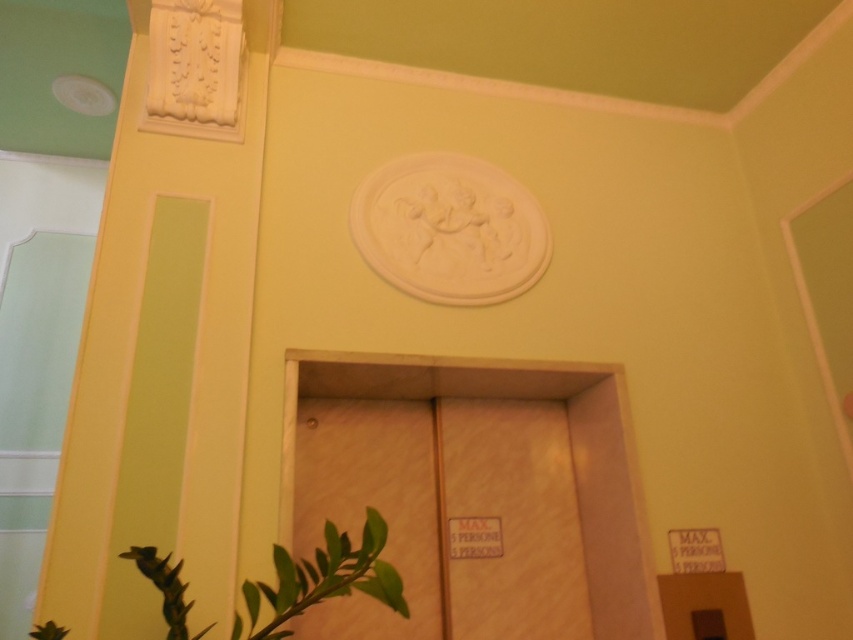
Which is more to the left, wooden elevator at center or green matte plant at lower left?

Positioned to the left is green matte plant at lower left.

Is point (485, 369) more distant than point (323, 572)?

Yes, point (485, 369) is farther from viewer.

This screenshot has height=640, width=853. Identify the location of wooden elevator at center. (572, 448).